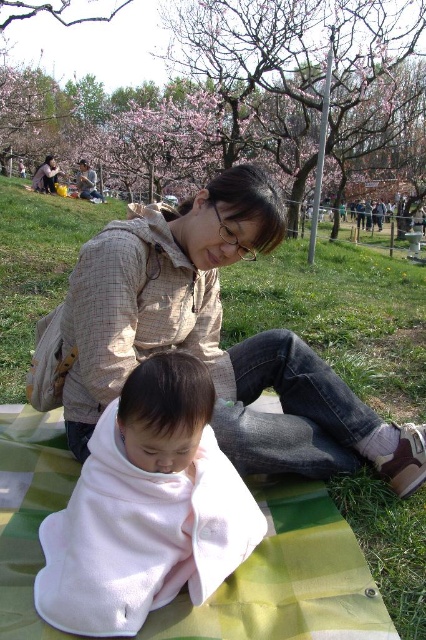
Question: Based on their relative distances, which object is nearer to the white fleece blanket at center?

Choices:
 (A) matte beige jacket at upper left
 (B) light brown plaid jacket at center

Answer: (B)

Question: Is light brown plaid jacket at center smaller than matte beige jacket at upper left?

Choices:
 (A) yes
 (B) no

Answer: (A)

Question: Does white fleece blanket at center lie behind matte beige jacket at upper left?

Choices:
 (A) no
 (B) yes

Answer: (A)

Question: Which of the following is the closest to the observer?

Choices:
 (A) (49, 156)
 (B) (218, 296)
 (C) (108, 625)

Answer: (C)

Question: Which point is farther from the camera taking this photo?

Choices:
 (A) (118, 564)
 (B) (48, 168)
 (C) (86, 424)

Answer: (B)

Question: Does white fleece blanket at center appear on the left side of matte beige jacket at upper left?

Choices:
 (A) no
 (B) yes

Answer: (A)